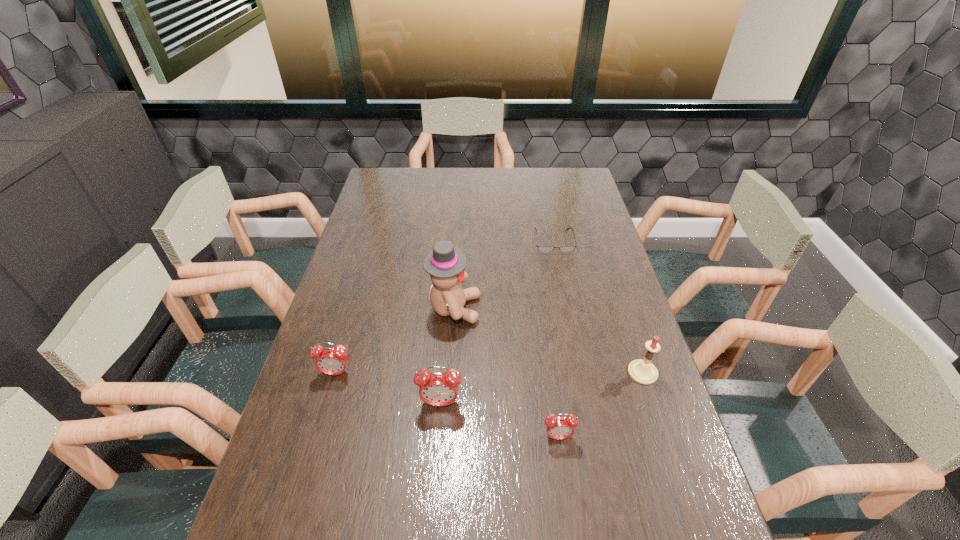
With all alarm clocks evenly spaced, where should an extra alarm clock be placed on the right to continue the pattern? Please point out a vacant space. Please provide its 2D coordinates. Your answer should be formatted as a tuple, i.e. [(x, y)], where the tuple contains the x and y coordinates of a point satisfying the conditions above.

[(692, 475)]